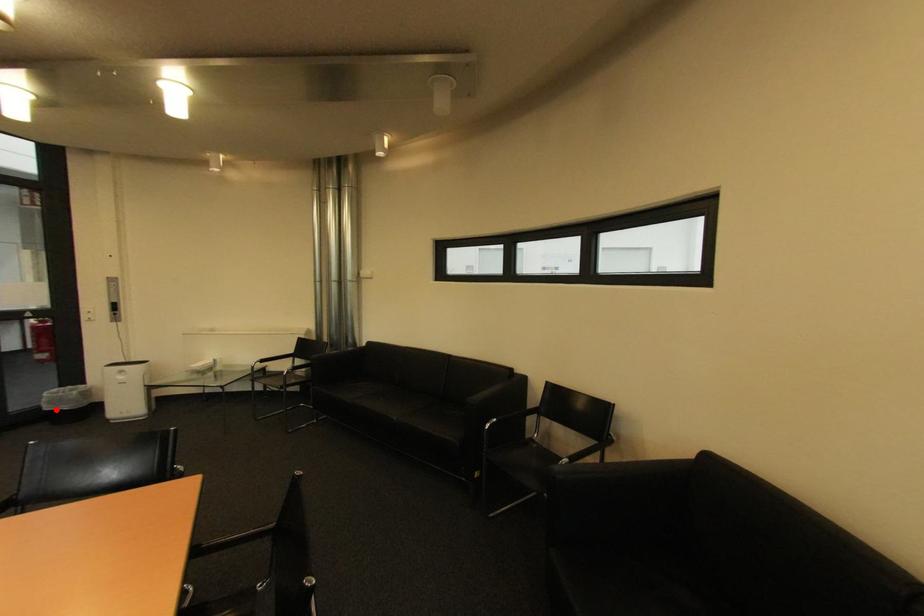
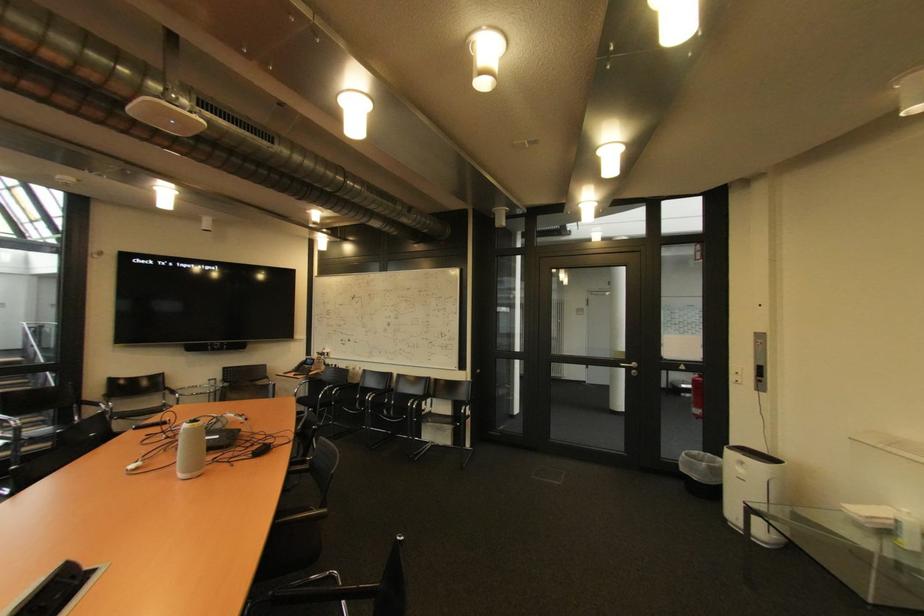
Locate, in the second image, the point that corresponds to the highlighted location in the first image.

(690, 471)